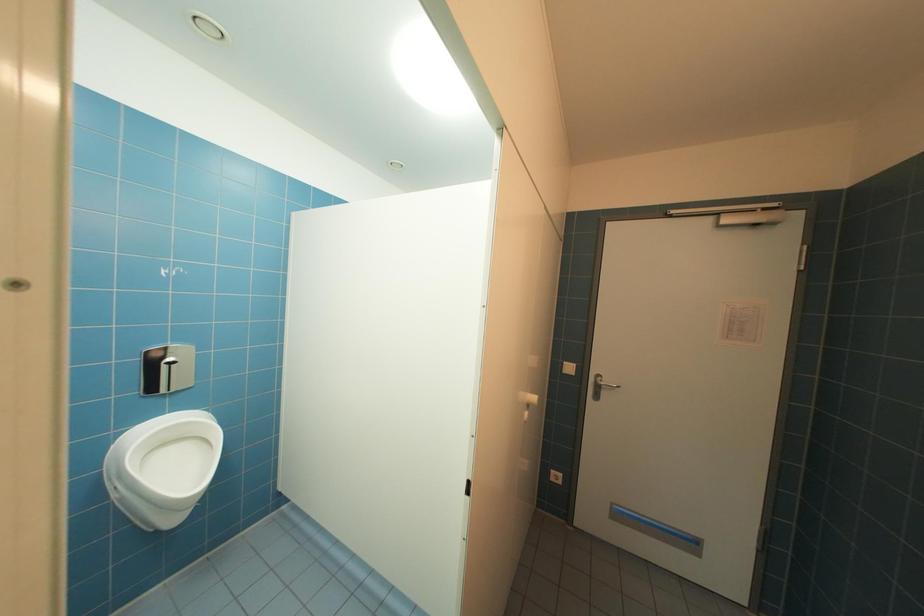
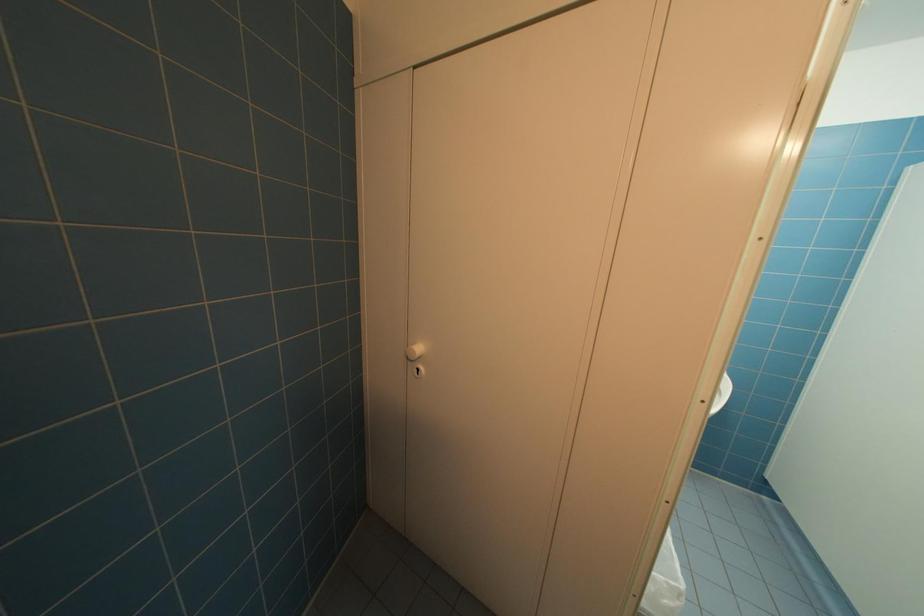
Question: The first image is from the beginning of the video and the second image is from the end. How did the camera likely rotate when shooting the video?

Choices:
 (A) Left
 (B) Right
 (C) Up
 (D) Down

Answer: (A)